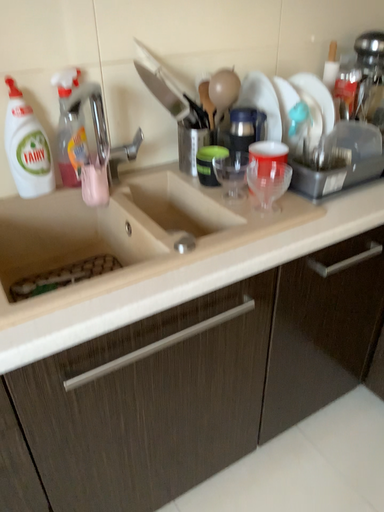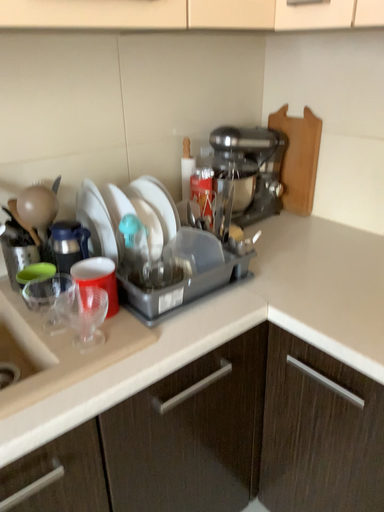
Question: Which way did the camera rotate in the video?

Choices:
 (A) rotated downward
 (B) rotated upward

Answer: (B)